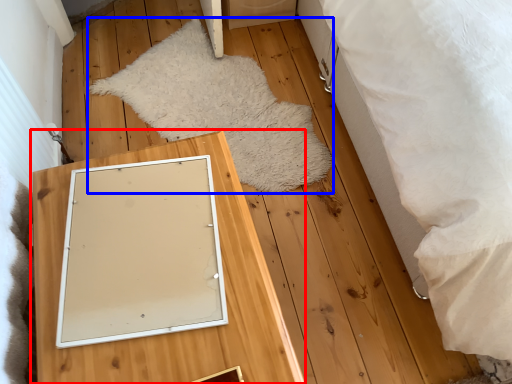
Question: Which object appears closest to the camera in this image, furniture (highlighted by a red box) or blanket (highlighted by a blue box)?

Choices:
 (A) furniture
 (B) blanket

Answer: (A)